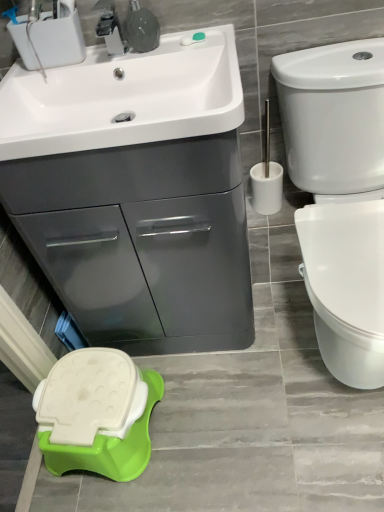
Question: From a real-world perspective, relative to brushed metal faucet at upper center, is white glossy sink at upper left vertically above or below?

Choices:
 (A) above
 (B) below

Answer: (B)

Question: Considering the positions of white glossy sink at upper left and brushed metal faucet at upper center in the image, is white glossy sink at upper left bigger or smaller than brushed metal faucet at upper center?

Choices:
 (A) big
 (B) small

Answer: (A)

Question: Estimate the real-world distances between objects in this image. Which object is farther from the white glossy toilet at right?

Choices:
 (A) white plastic toilet brush at right
 (B) brushed metal faucet at upper center
 (C) matte gray cabinet at upper left
 (D) white glossy sink at upper left
 (E) green plastic stool at lower left

Answer: (E)

Question: Based on their relative distances, which object is nearer to the matte gray cabinet at upper left?

Choices:
 (A) brushed metal faucet at upper center
 (B) green plastic stool at lower left
 (C) white plastic toilet brush at right
 (D) white glossy toilet at right
 (E) white glossy sink at upper left

Answer: (B)